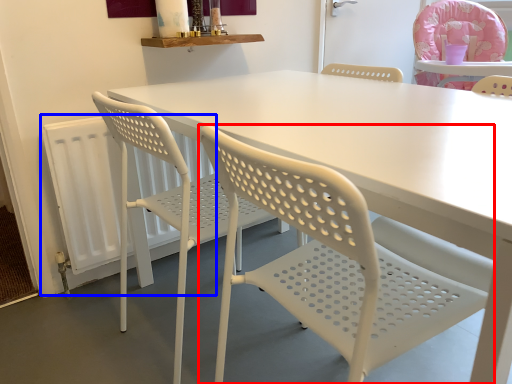
Question: Among these objects, which one is nearest to the camera, chair (highlighted by a red box) or radiator (highlighted by a blue box)?

Choices:
 (A) chair
 (B) radiator

Answer: (A)